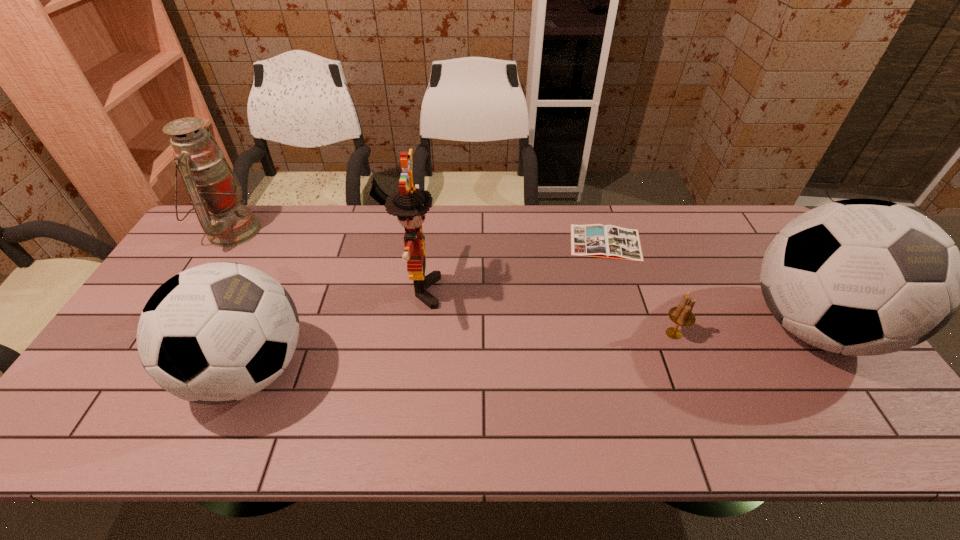
Identify the location of the fourth closest object to the leftmost object. (682, 315).

Select which object is the fifth closest to the fifth object from right to left. Please provide its 2D coordinates. Your answer should be formatted as a tuple, i.e. [(x, y)], where the tuple contains the x and y coordinates of a point satisfying the conditions above.

[(861, 277)]

Locate an element on the screen. Image resolution: width=960 pixels, height=540 pixels. vacant point that satisfies the following two spatial constraints: 1. on the main logo of the right soccer ball; 2. on the main logo of the fourth tallest object is located at coordinates (842, 371).

The image size is (960, 540). Identify the location of vacant area in the image that satisfies the following two spatial constraints: 1. on the front-facing side of the second shortest object; 2. on the right side of the fourth object from right to left. (416, 334).

Find the location of `vacant region that satisfies the following two spatial constraints: 1. on the front side of the book; 2. on the main logo of the shorter soccer ball`. vacant region that satisfies the following two spatial constraints: 1. on the front side of the book; 2. on the main logo of the shorter soccer ball is located at coordinates (645, 371).